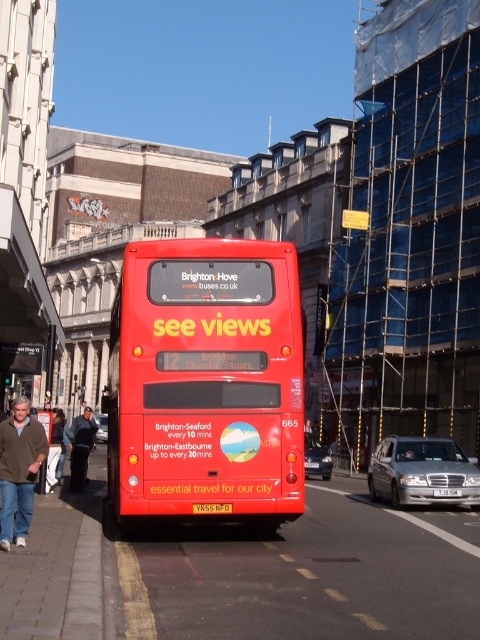
Question: From the image, what is the correct spatial relationship of silver metallic sedan at lower right in relation to silver metallic car at center?

Choices:
 (A) below
 (B) above

Answer: (B)

Question: Which object is positioned farthest from the matte red bus at center?

Choices:
 (A) silver metallic sedan at center
 (B) silver metallic car at center

Answer: (B)

Question: Estimate the real-world distances between objects in this image. Which object is farther from the silver metallic car at center?

Choices:
 (A) matte red bus at center
 (B) silver metallic sedan at lower right

Answer: (B)

Question: Is matte red bus at center below silver metallic sedan at lower right?

Choices:
 (A) yes
 (B) no

Answer: (B)

Question: Does silver metallic sedan at lower right appear on the left side of white plastic license plate at center?

Choices:
 (A) yes
 (B) no

Answer: (B)

Question: Which of the following is the farthest from the observer?

Choices:
 (A) (452, 454)
 (B) (304, 465)

Answer: (A)